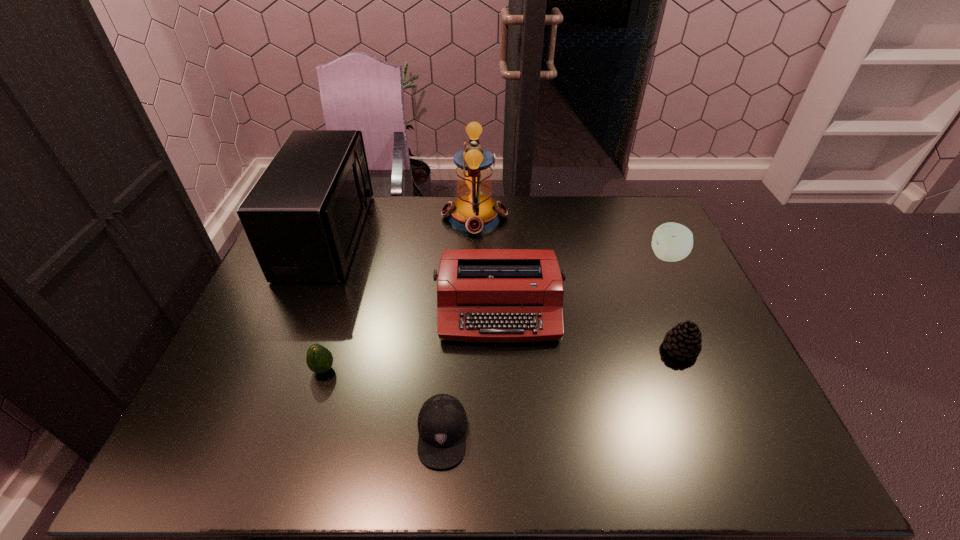
The width and height of the screenshot is (960, 540). In order to click on apple at the right edge in this screenshot , I will do `click(671, 242)`.

The image size is (960, 540). I want to click on pinecone that is at the right edge, so click(684, 340).

This screenshot has width=960, height=540. In order to click on object present at the far left corner in this screenshot , I will do `click(303, 217)`.

Find the location of a particular element. This screenshot has height=540, width=960. vacant space at the near edge is located at coordinates (388, 448).

Where is `free space at the right edge of the desktop`? The height and width of the screenshot is (540, 960). free space at the right edge of the desktop is located at coordinates (723, 380).

You are a GUI agent. You are given a task and a screenshot of the screen. Output one action in this format:
    pyautogui.click(x=<x>, y=<y>)
    Task: Click on the free region at the far right corner
    
    Given the screenshot: What is the action you would take?
    pyautogui.click(x=630, y=232)

Where is `blank region between the apple and the cap`? Image resolution: width=960 pixels, height=540 pixels. blank region between the apple and the cap is located at coordinates (555, 345).

Image resolution: width=960 pixels, height=540 pixels. In order to click on empty location between the pinecone and the typewriter in this screenshot , I will do `click(589, 329)`.

Locate an element on the screen. free spot between the pinecone and the shortest object is located at coordinates (561, 392).

Identify the location of empty location between the pinecone and the avocado. This screenshot has width=960, height=540. (502, 360).